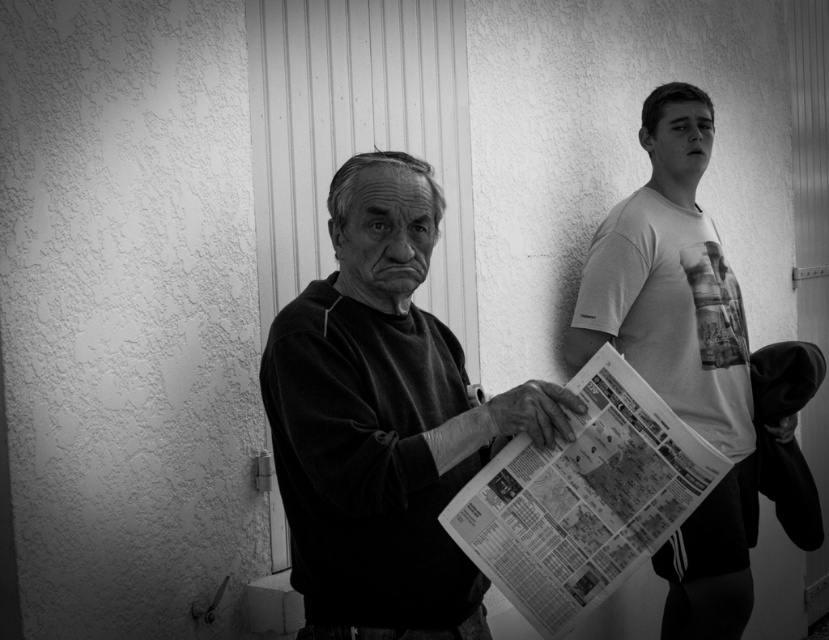
You are a photographer trying to capture a closeup of the printed newspaper at center without the matte black sweater at center blocking it. Based on their sizes, can you suggest a way to frame the shot?

The matte black sweater at center is taller than the printed newspaper at center, so you can lower your camera angle to position the sweater below the newspaper in the frame, ensuring the newspaper is fully visible without obstruction.